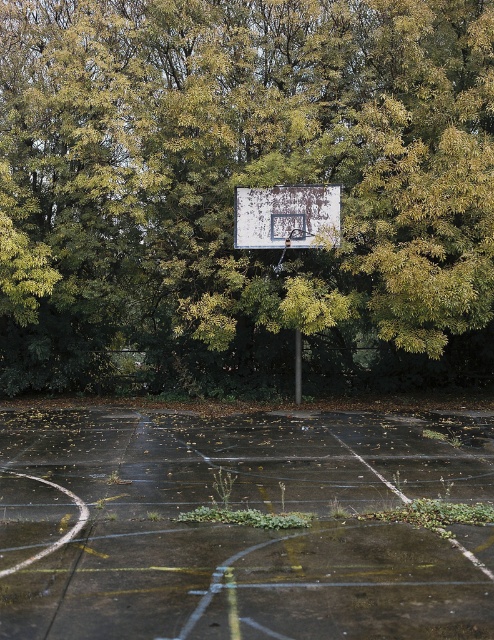
Question: Among these points, which one is nearest to the camera?

Choices:
 (A) (249, 93)
 (B) (41, 500)
 (C) (323, 227)

Answer: (B)

Question: Does concrete court at center have a greater width compared to white painted metal basketball backboard at center?

Choices:
 (A) no
 (B) yes

Answer: (B)

Question: Among these points, which one is farthest from the camera?

Choices:
 (A) pos(280,284)
 (B) pos(410,420)
 (C) pos(241,198)

Answer: (A)

Question: Based on their relative distances, which object is nearer to the concrete court at center?

Choices:
 (A) white painted metal basketball backboard at center
 (B) green leafy tree at upper center

Answer: (A)

Question: Does green leafy tree at upper center have a greater width compared to concrete court at center?

Choices:
 (A) yes
 (B) no

Answer: (A)

Question: Observing the image, what is the correct spatial positioning of green leafy tree at upper center in reference to white painted metal basketball backboard at center?

Choices:
 (A) right
 (B) left

Answer: (B)